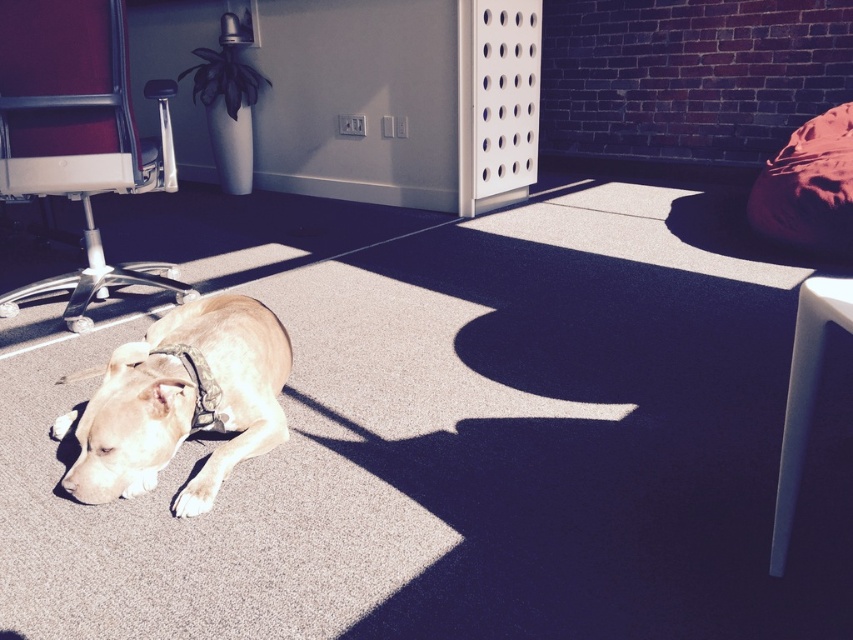
Is point (242, 312) closer to camera compared to point (206, 408)?

No, it is behind (206, 408).

Does light brown fur at center lie behind black fabric neckband at lower left?

No, light brown fur at center is in front of black fabric neckband at lower left.

Which is behind, point (125, 368) or point (192, 371)?

The point (192, 371) is more distant.

The height and width of the screenshot is (640, 853). In order to click on light brown fur at center in this screenshot , I will do `click(183, 401)`.

Between metallic silver office chair at left and black fabric neckband at lower left, which one appears on the right side from the viewer's perspective?

black fabric neckband at lower left is more to the right.

Between point (62, 86) and point (190, 358), which one is positioned in front?

Positioned in front is point (190, 358).

The image size is (853, 640). Find the location of `metallic silver office chair at left`. metallic silver office chair at left is located at coordinates (78, 134).

Is light brown fur at center smaller than white plastic stool at lower right?

No, light brown fur at center is not smaller than white plastic stool at lower right.

Which is behind, point (146, 476) or point (842, 278)?

The point (842, 278) is behind.

This screenshot has height=640, width=853. I want to click on light brown fur at center, so click(183, 401).